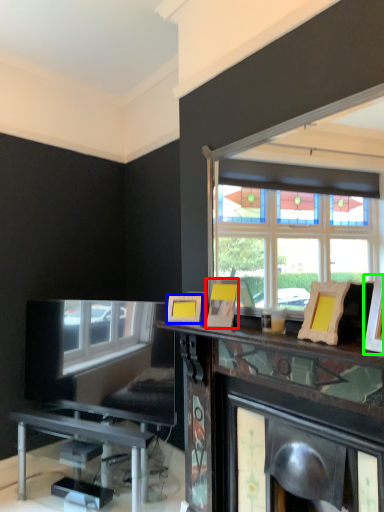
Question: Estimate the real-world distances between objects in this image. Which object is farther from picture frame (highlighted by a red box), picture frame (highlighted by a blue box) or picture frame (highlighted by a green box)?

Choices:
 (A) picture frame
 (B) picture frame

Answer: (B)